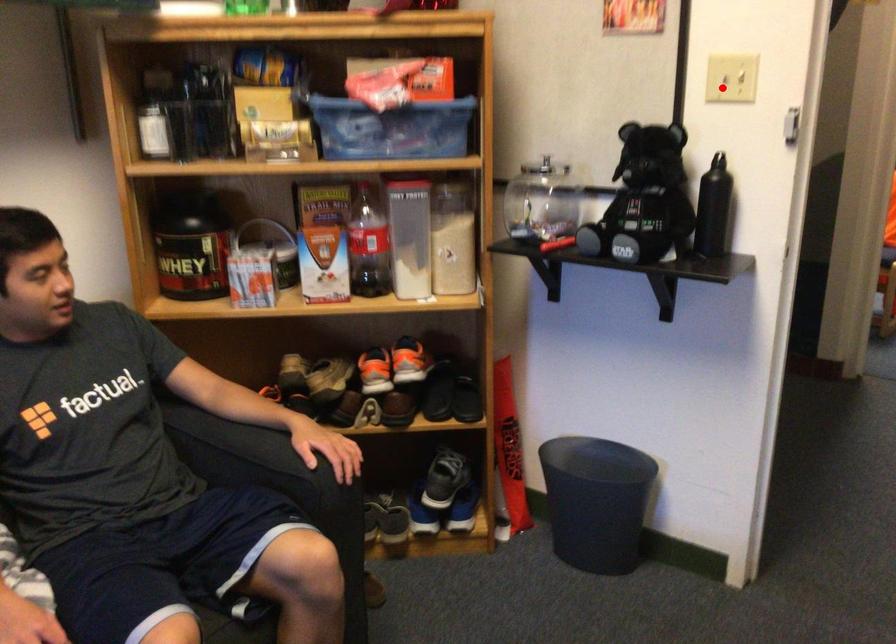
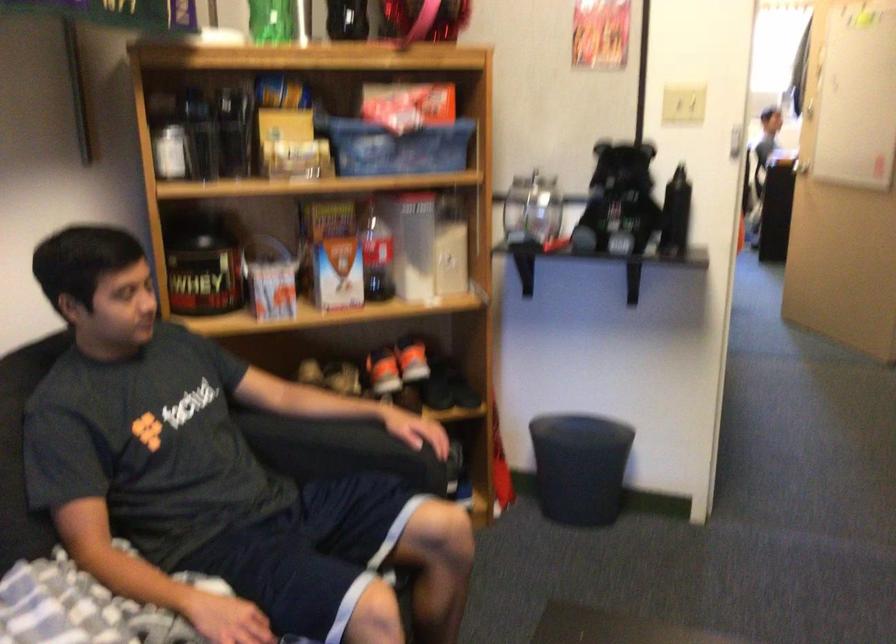
Find the pixel in the second image that matches the highlighted location in the first image.

(682, 106)